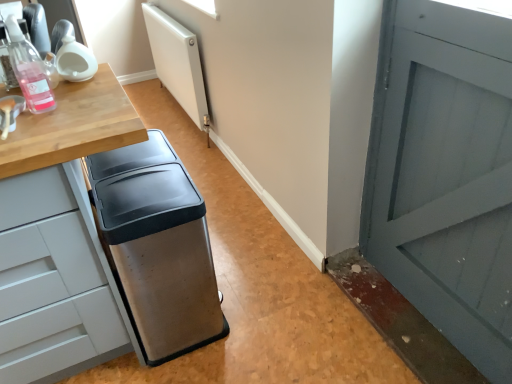
Where is `unoccupied region to the right of translucent plastic bottle at left`? unoccupied region to the right of translucent plastic bottle at left is located at coordinates click(x=89, y=106).